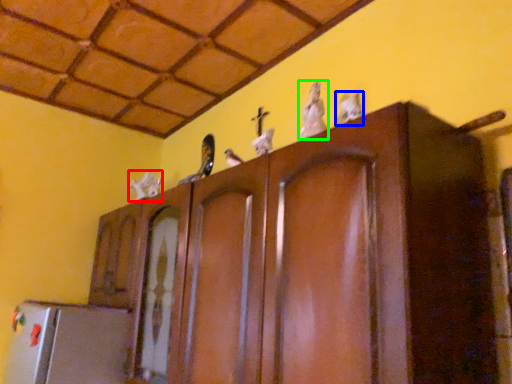
Question: Which is farther away from animal (highlighted by a red box)? animal (highlighted by a blue box) or animal (highlighted by a green box)?

Choices:
 (A) animal
 (B) animal

Answer: (A)